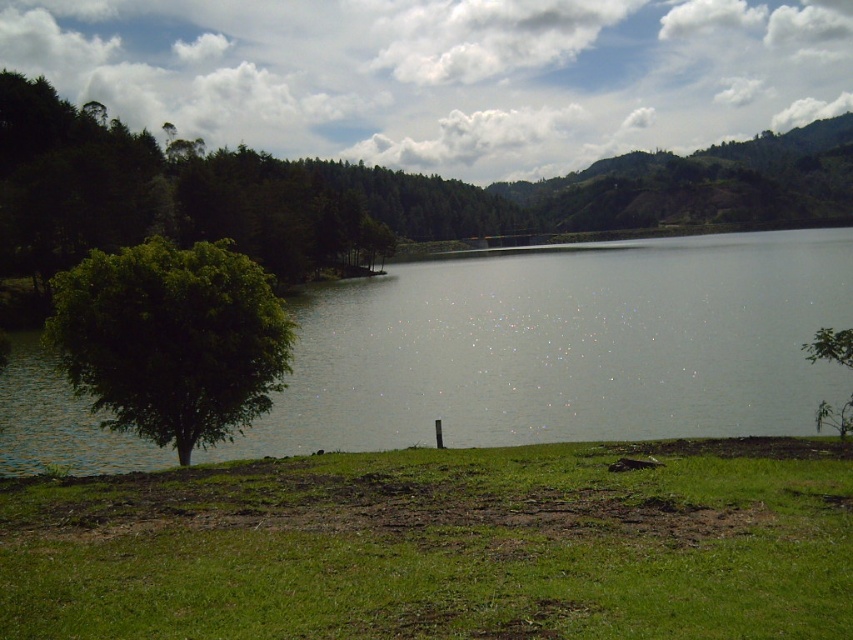
Question: Is green leafy tree at left above green leafy tree at lower right?

Choices:
 (A) yes
 (B) no

Answer: (A)

Question: Is green grassy at lower center in front of greenish water at center?

Choices:
 (A) no
 (B) yes

Answer: (B)

Question: Is green leafy tree at left thinner than green leafy tree at lower right?

Choices:
 (A) no
 (B) yes

Answer: (A)

Question: Estimate the real-world distances between objects in this image. Which object is farther from the green grassy at lower center?

Choices:
 (A) green leafy tree at lower right
 (B) greenish water at center

Answer: (B)

Question: Which point is farther to the camera?

Choices:
 (A) (175, 280)
 (B) (213, 552)
 (C) (730, 280)

Answer: (C)

Question: Estimate the real-world distances between objects in this image. Which object is closer to the greenish water at center?

Choices:
 (A) green leafy tree at lower right
 (B) green grassy at lower center

Answer: (B)